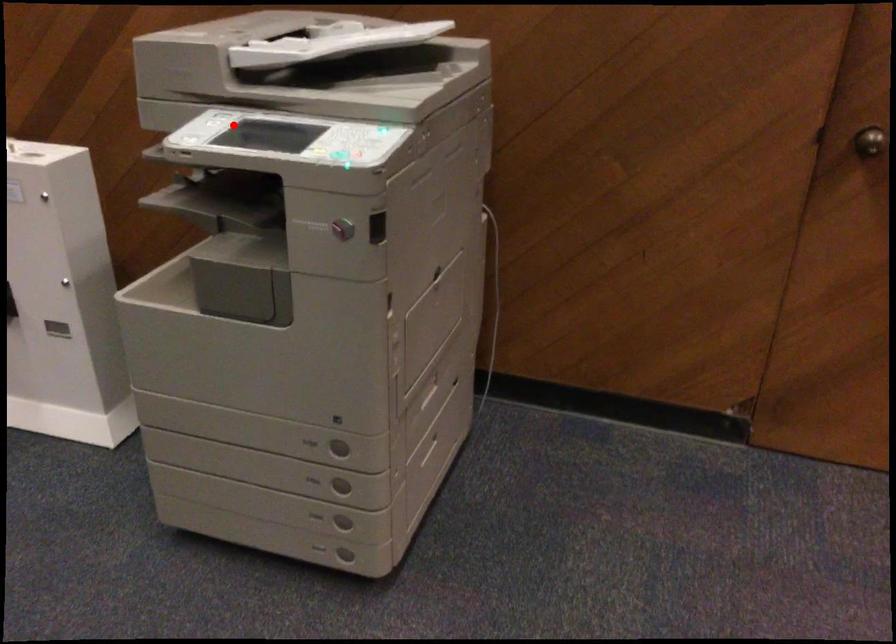
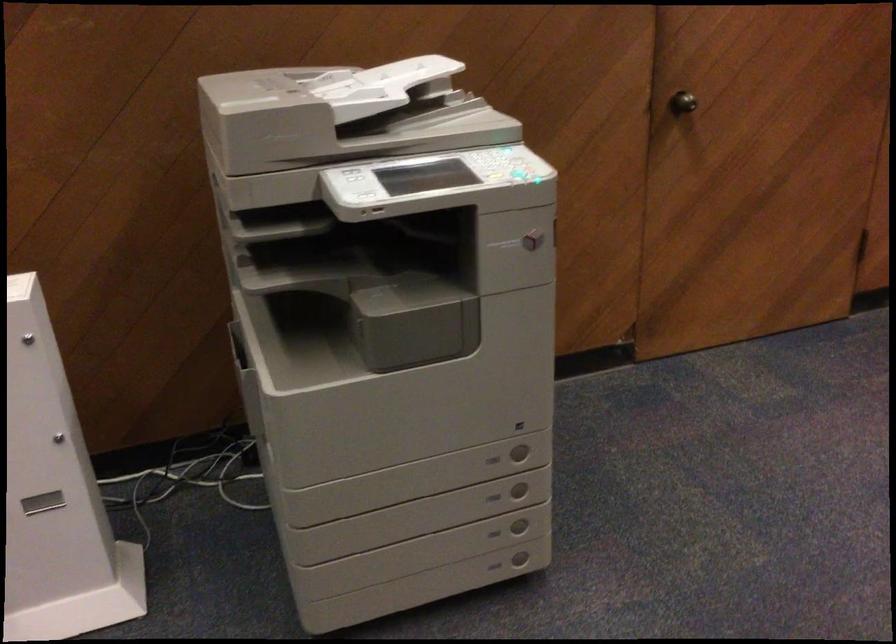
The point at the highlighted location is marked in the first image. Where is the corresponding point in the second image?

(354, 175)